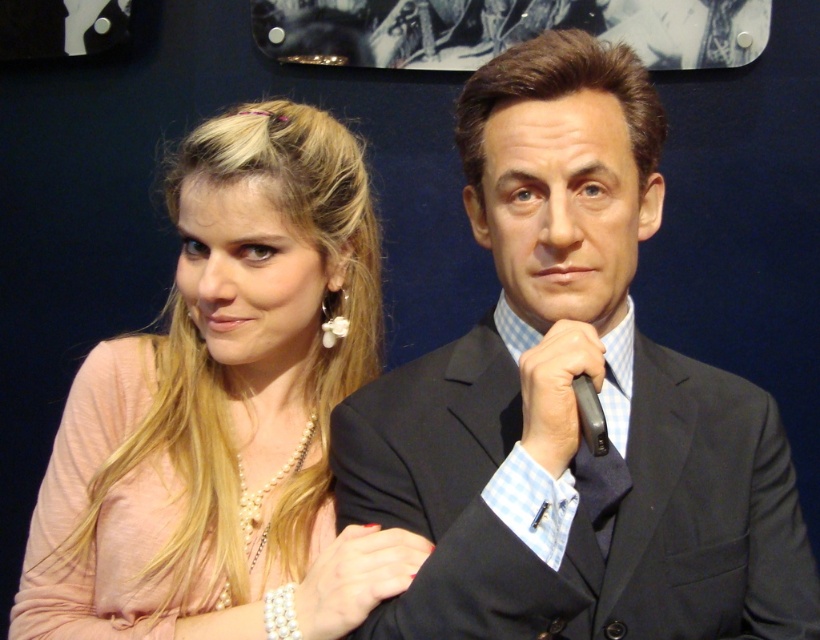
You are organizing a photoshoot and need to ensure that the pearl necklace at center and the smooth black suit at center are visible in the frame. Based on their positions, which object is closer to the right edge of the image?

The smooth black suit at center is positioned on the right side of the pearl necklace at center, so the smooth black suit at center is closer to the right edge of the image.

You are a photographer adjusting the camera focus. You notice two objects at the center of the image, the pearl necklace at center and the dark blue textured tie at center. Which object is positioned higher in the frame?

The pearl necklace at center is taller than the dark blue textured tie at center, so it is positioned higher in the frame.

You are a photographer setting up for a portrait session. You need to ensure that the smooth black suit at center and the dark blue textured tie at center are both visible in the frame. Based on their positions, which one should you focus on first to ensure the tie is in focus?

The smooth black suit at center is located above the dark blue textured tie at center. To ensure the tie is in focus, you should focus on the dark blue textured tie at center first since it is lower and might be closer to the camera if the suit is above it.